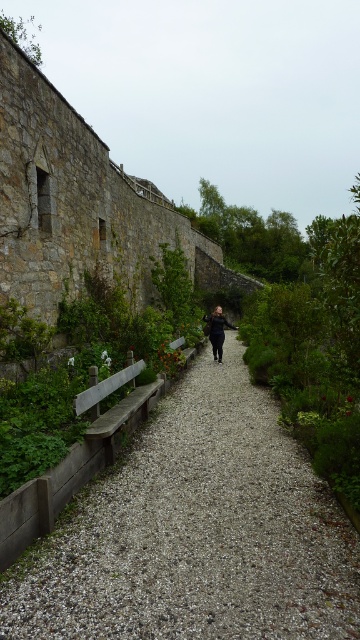
Consider the image. You are designing a garden layout and need to place a new decorative item between the wooden bench at left and the black matte jacket at center. Which object should you place the item closer to if you want it to be near the larger object?

You should place the item closer to the black matte jacket at center because it occupies more space than the wooden bench at left.

You are planning to sit on the wooden bench at left while wearing the black matte jacket at center. Can you do so without the jacket getting in the way?

The wooden bench at left is below the black matte jacket at center, so sitting on the bench would place the jacket above it. Since the jacket is on your body, it won

You are standing at the entrance of the garden and see the gray gravel at center and the black matte jacket at center. Which object is closer to you?

The gray gravel at center is closer to you because it is in front of the black matte jacket at center.